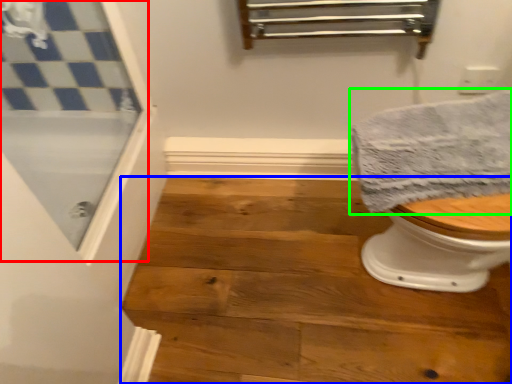
Question: Which object is positioned closest to screen door (highlighted by a red box)? Select from stair (highlighted by a blue box) and towel (highlighted by a green box).

Choices:
 (A) stair
 (B) towel

Answer: (A)